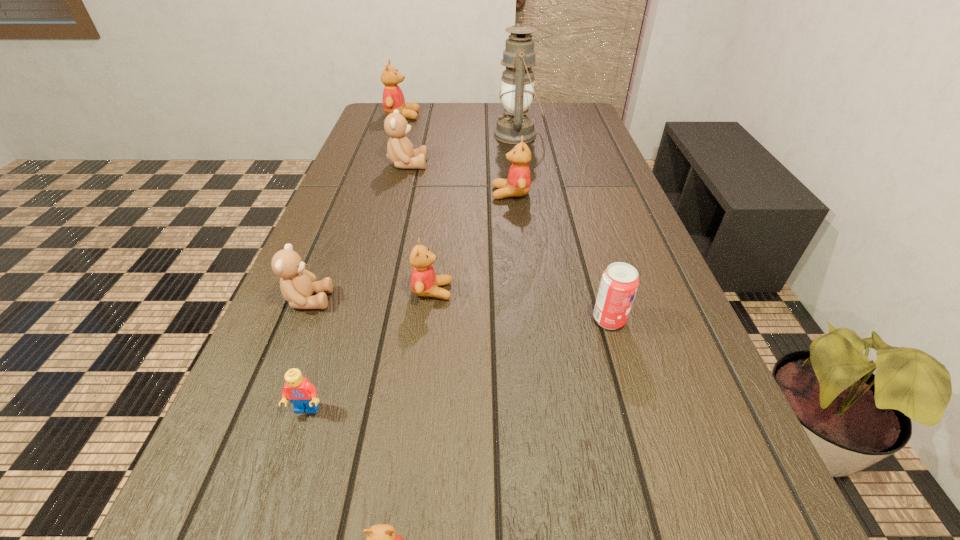
Locate an element on the screen. the fifth closest teddy bear relative to the Lego is located at coordinates (400, 151).

Find the location of `the third closest teddy bear relative to the shortest teddy bear`. the third closest teddy bear relative to the shortest teddy bear is located at coordinates (518, 182).

What are the coordinates of `red teddy bear that is the closest one to the third smallest red teddy bear` in the screenshot? It's located at (424, 282).

At what (x,y) coordinates should I click in order to perform the action: click on the fourth closest red teddy bear to the left brown teddy bear. Please return your answer as a coordinate pair (x, y). Looking at the image, I should click on (393, 99).

Where is `brown teddy bear that is the second closest to the leftmost red teddy bear`? brown teddy bear that is the second closest to the leftmost red teddy bear is located at coordinates (297, 285).

The image size is (960, 540). Find the location of `free spot that satisfies the following two spatial constraints: 1. on the front-facing side of the biggest red teddy bear; 2. on the right side of the soda can`. free spot that satisfies the following two spatial constraints: 1. on the front-facing side of the biggest red teddy bear; 2. on the right side of the soda can is located at coordinates (335, 320).

Where is `free region that satisfies the following two spatial constraints: 1. on the face of the nearer brown teddy bear; 2. on the back side of the rightmost object`? free region that satisfies the following two spatial constraints: 1. on the face of the nearer brown teddy bear; 2. on the back side of the rightmost object is located at coordinates (300, 320).

The height and width of the screenshot is (540, 960). In order to click on blank area in the image that satisfies the following two spatial constraints: 1. on the front side of the tallest object; 2. on the front-facing side of the third farthest red teddy bear in this screenshot , I will do `click(540, 291)`.

Find the location of a particular element. The height and width of the screenshot is (540, 960). vacant point that satisfies the following two spatial constraints: 1. on the back side of the rightmost object; 2. on the face of the left brown teddy bear is located at coordinates (603, 300).